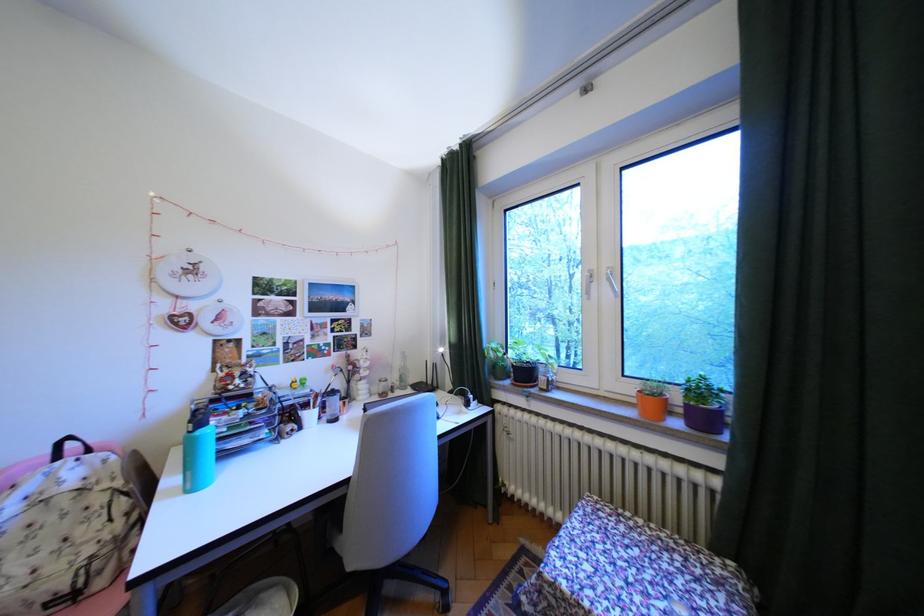
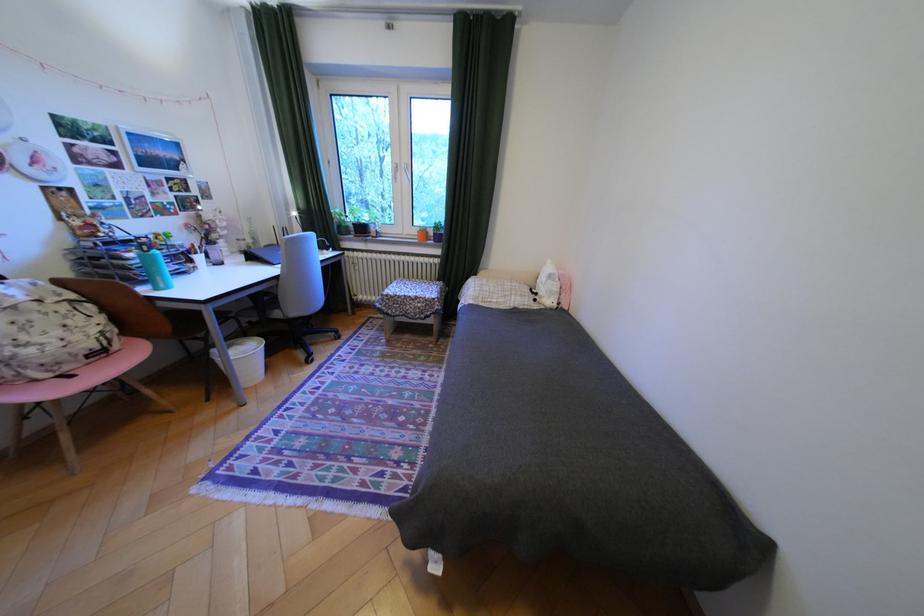
Where in the second image is the point corresponding to point 65,519 from the first image?

(49, 317)